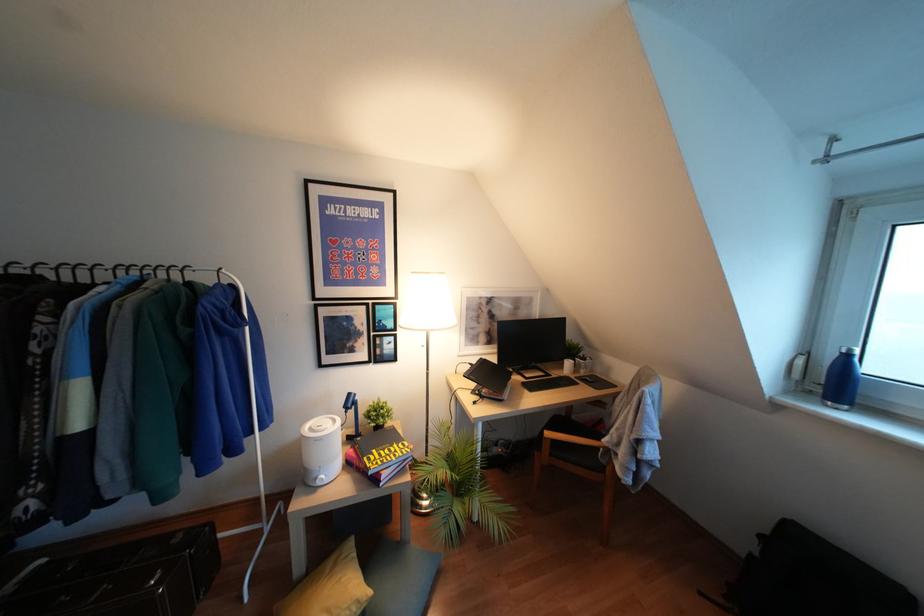
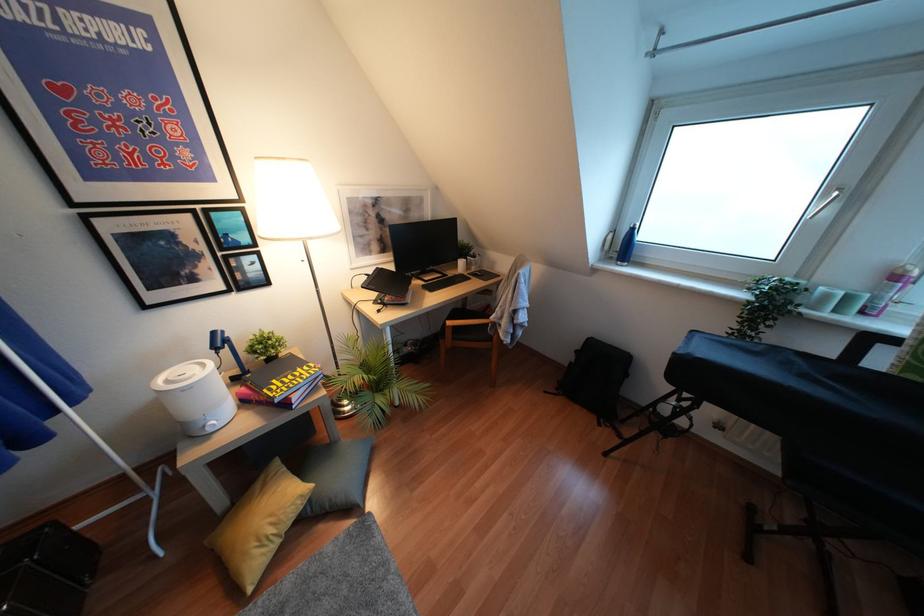
The point at (319, 483) is marked in the first image. Where is the corresponding point in the second image?

(210, 430)